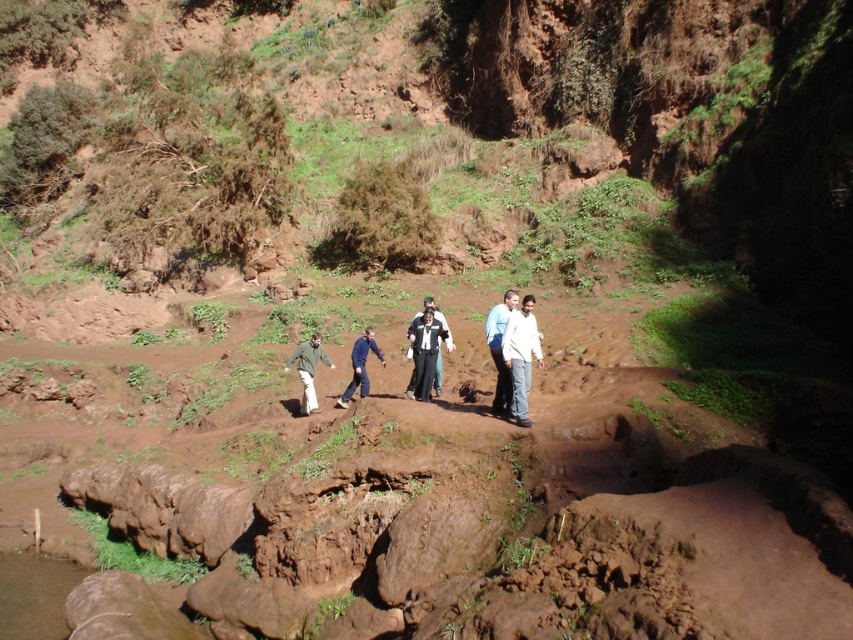
Where is `white matte shirt at center`? Image resolution: width=853 pixels, height=640 pixels. white matte shirt at center is located at coordinates (521, 355).

Who is positioned more to the right, white matte shirt at center or blue fabric pants at center?

white matte shirt at center is more to the right.

Is point (524, 344) closer to viewer compared to point (351, 388)?

Yes, point (524, 344) is closer to viewer.

Locate an element on the screen. The height and width of the screenshot is (640, 853). white matte shirt at center is located at coordinates (521, 355).

Is point (523, 378) in front of point (416, 387)?

Yes, it is in front of point (416, 387).

I want to click on white matte shirt at center, so click(x=521, y=355).

Where is `blue fabric shirt at center`? blue fabric shirt at center is located at coordinates (500, 349).

You are a GUI agent. You are given a task and a screenshot of the screen. Output one action in this format:
    pyautogui.click(x=<x>, y=<y>)
    Task: Click on the blue fabric shirt at center
    Image resolution: width=853 pixels, height=640 pixels.
    Given the screenshot: What is the action you would take?
    pyautogui.click(x=500, y=349)